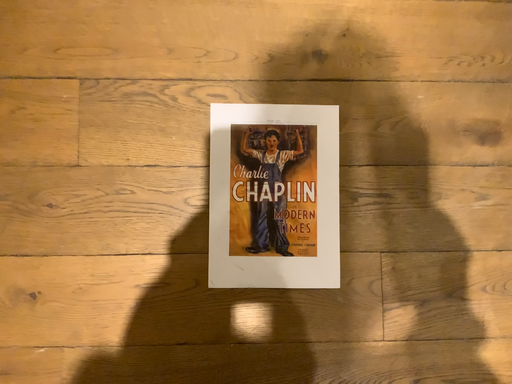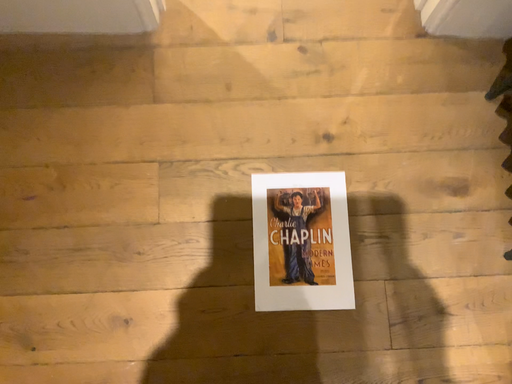
Question: Which way did the camera rotate in the video?

Choices:
 (A) rotated upward
 (B) rotated downward

Answer: (A)